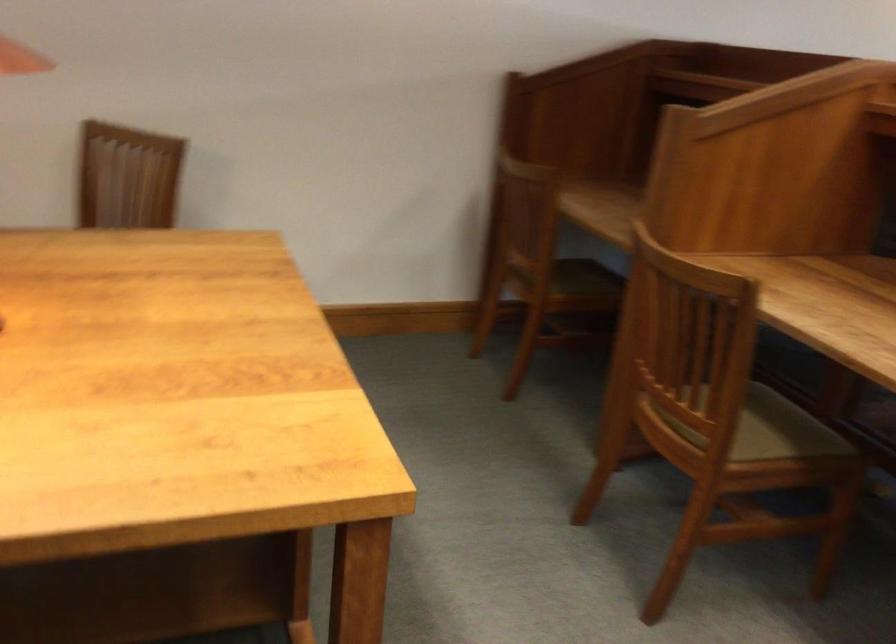
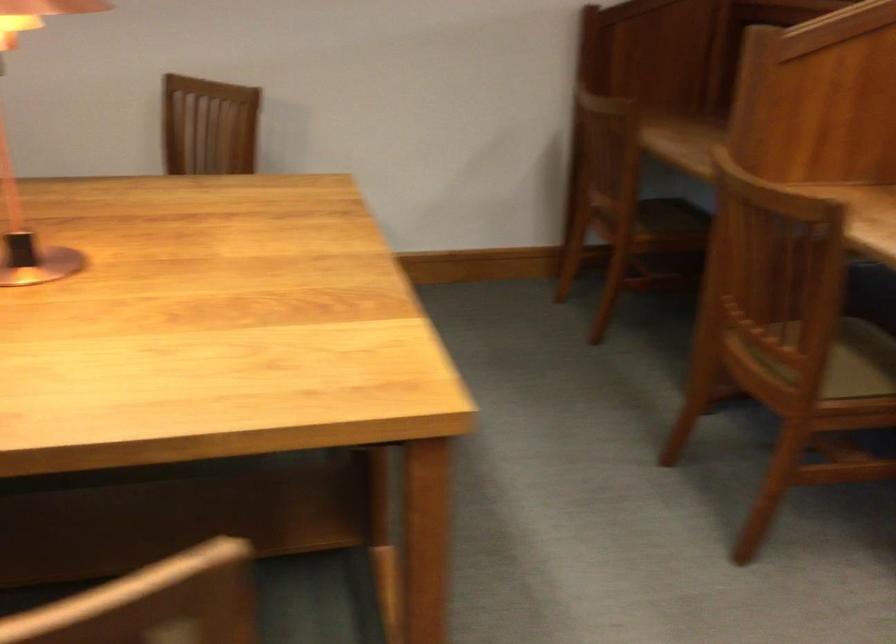
Question: The camera is either moving clockwise (left) or counter-clockwise (right) around the object. The first image is from the beginning of the video and the second image is from the end. Is the camera moving left or right when shooting the video?

Choices:
 (A) Left
 (B) Right

Answer: (B)